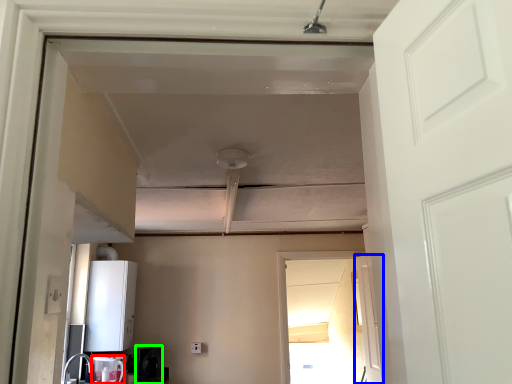
Question: Which is farther away from appliance (highlighted by a red box)? door (highlighted by a blue box) or appliance (highlighted by a green box)?

Choices:
 (A) door
 (B) appliance

Answer: (A)